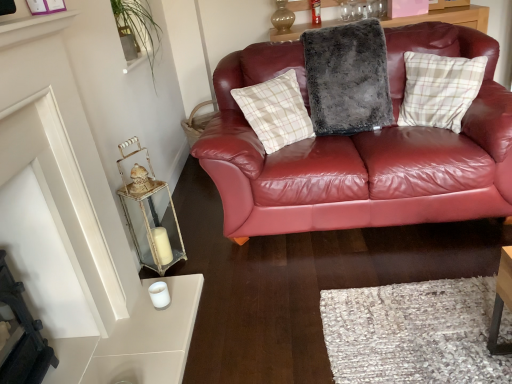
Find the location of a particular element. free location to the right of metallic glass lantern at left is located at coordinates (202, 257).